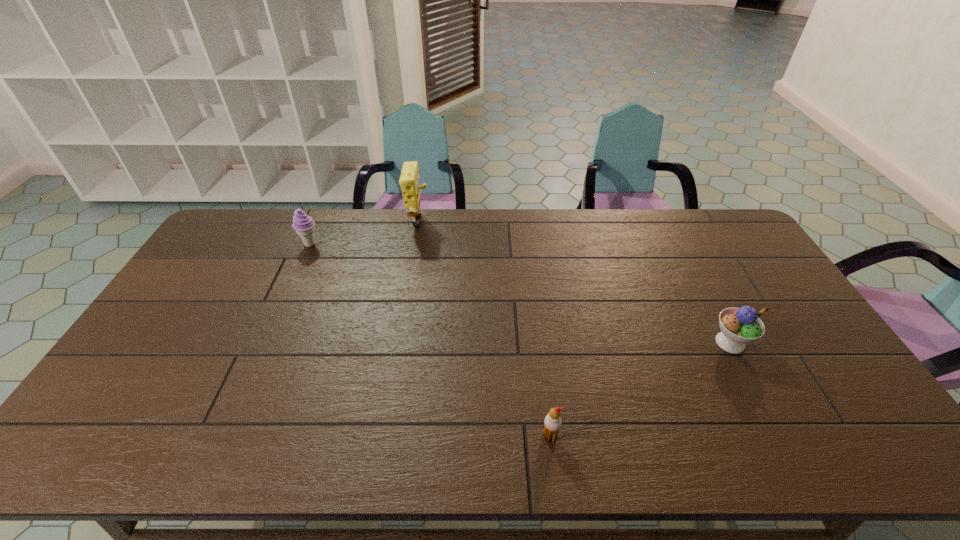
You are a GUI agent. You are given a task and a screenshot of the screen. Output one action in this format:
    pyautogui.click(x=<x>, y=<y>)
    Task: Click on the closest object to the second nearest object
    The width and height of the screenshot is (960, 540).
    Given the screenshot: What is the action you would take?
    pyautogui.click(x=552, y=423)

The height and width of the screenshot is (540, 960). I want to click on the closest icecream to the shortest icecream, so click(x=738, y=326).

The height and width of the screenshot is (540, 960). In order to click on icecream object that ranks as the second closest to the rightmost object in this screenshot , I will do `click(303, 224)`.

Where is `vacant space that satisfies the following two spatial constraints: 1. on the face of the tallest object; 2. on the left side of the rightmost object`? vacant space that satisfies the following two spatial constraints: 1. on the face of the tallest object; 2. on the left side of the rightmost object is located at coordinates 398,342.